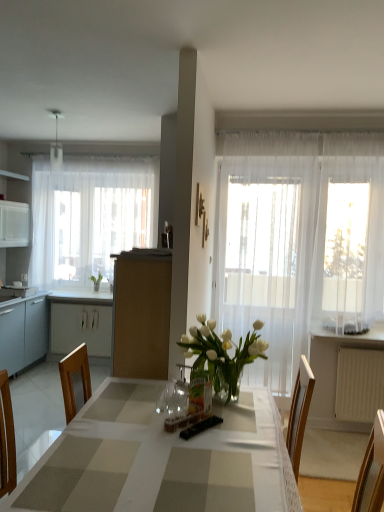
Describe the element at coordinates (90, 216) in the screenshot. Image resolution: width=384 pixels, height=512 pixels. I see `white sheer curtain at left, the 2th curtain in the right-to-left sequence` at that location.

This screenshot has height=512, width=384. What are the coordinates of `transparent fabric window at right` in the screenshot? It's located at (349, 244).

Locate an element on the screen. The height and width of the screenshot is (512, 384). white glossy counter top at lower left is located at coordinates (81, 297).

What is the approximate height of green leafy plant at left?

green leafy plant at left is 10.05 inches tall.

Where is `checkered fabric table at center`? checkered fabric table at center is located at coordinates (162, 459).

Locate an element on the screen. The width and height of the screenshot is (384, 512). white sheer curtain at left, the first curtain from the left is located at coordinates (90, 216).

Which is behind, green leafy plant at left or white glossy counter top at lower left?

green leafy plant at left is more distant.

Which object is thinner, green leafy plant at left or white glossy counter top at lower left?

green leafy plant at left.

Considering the sizes of green leafy plant at left and white glossy counter top at lower left in the image, is green leafy plant at left taller or shorter than white glossy counter top at lower left?

Clearly, green leafy plant at left is taller compared to white glossy counter top at lower left.

Would you say white matte cabinet at left, acting as the first cabinetry starting from the back, is to the left or to the right of checkered fabric table at center in the picture?

Clearly, white matte cabinet at left, acting as the first cabinetry starting from the back, is on the left of checkered fabric table at center in the image.

You are a GUI agent. You are given a task and a screenshot of the screen. Output one action in this format:
    pyautogui.click(x=<x>, y=<y>)
    Task: Click on the cabinetry that is the 2nd one when counting backward from the checkered fabric table at center
    
    Given the screenshot: What is the action you would take?
    pyautogui.click(x=80, y=322)

Could you tell me if white matte cabinet at left, which is counted as the 1th cabinetry, starting from the right, is facing checkered fabric table at center?

Yes, white matte cabinet at left, which is counted as the 1th cabinetry, starting from the right, is oriented towards checkered fabric table at center.

From a real-world perspective, is white matte cabinet at left, the second cabinetry positioned from the front, above or below checkered fabric table at center?

In terms of real-world spatial position, white matte cabinet at left, the second cabinetry positioned from the front, is below checkered fabric table at center.

Is white sheer curtain at left, the 2th curtain in the right-to-left sequence, not within translucent glass vase at center?

white sheer curtain at left, the 2th curtain in the right-to-left sequence, lies outside translucent glass vase at center's area.

Who is bigger, white sheer curtain at left, the first curtain from the left, or translucent glass vase at center?

white sheer curtain at left, the first curtain from the left.

From the image's perspective, which is below, white sheer curtain at left, which ranks as the first curtain in back-to-front order, or translucent glass vase at center?

translucent glass vase at center.

The image size is (384, 512). What are the coordinates of `the 2nd curtain directly above the translucent glass vase at center (from a real-world perspective)` in the screenshot? It's located at (90, 216).

Is matte blue cabinet at left, the first cabinetry from the front, not within white sheer curtain at left, the 2th curtain in the right-to-left sequence?

Indeed, matte blue cabinet at left, the first cabinetry from the front, is completely outside white sheer curtain at left, the 2th curtain in the right-to-left sequence.

Which object is more forward, matte blue cabinet at left, which is the 2th cabinetry from right to left, or white sheer curtain at left, which ranks as the first curtain in back-to-front order?

matte blue cabinet at left, which is the 2th cabinetry from right to left, is closer to the camera.

Between matte blue cabinet at left, which is the 2th cabinetry from right to left, and white sheer curtain at left, the first curtain from the left, which one has larger size?

With larger size is matte blue cabinet at left, which is the 2th cabinetry from right to left.

From a real-world perspective, is matte blue cabinet at left, which is the 2th cabinetry from right to left, physically above white sheer curtain at left, which ranks as the first curtain in back-to-front order?

Actually, matte blue cabinet at left, which is the 2th cabinetry from right to left, is physically below white sheer curtain at left, which ranks as the first curtain in back-to-front order, in the real world.

Is checkered fabric table at center oriented towards matte blue cabinet at left, which is the 2th cabinetry from right to left?

No, checkered fabric table at center is not facing towards matte blue cabinet at left, which is the 2th cabinetry from right to left.

Considering their positions, is checkered fabric table at center located in front of or behind matte blue cabinet at left, which ranks as the 2th cabinetry in back-to-front order?

Clearly, checkered fabric table at center is in front of matte blue cabinet at left, which ranks as the 2th cabinetry in back-to-front order.

In terms of height, does checkered fabric table at center look taller or shorter compared to matte blue cabinet at left, which is the 2th cabinetry from right to left?

Clearly, checkered fabric table at center is shorter compared to matte blue cabinet at left, which is the 2th cabinetry from right to left.

From the image's perspective, starting from the checkered fabric table at center, which cabinetry is the 2nd one above? Please provide its 2D coordinates.

[(23, 331)]

Measure the distance between white matte cabinet at left, the second cabinetry positioned from the front, and matte blue cabinet at left, which is the 2th cabinetry from right to left.

white matte cabinet at left, the second cabinetry positioned from the front, is 17.29 inches from matte blue cabinet at left, which is the 2th cabinetry from right to left.

From the image's perspective, is white matte cabinet at left, which is counted as the 1th cabinetry, starting from the right, under matte blue cabinet at left, which ranks as the 1th cabinetry in left-to-right order?

Yes.

Does point (106, 322) come in front of point (22, 335)?

No.

Can you confirm if white matte cabinet at left, the second cabinetry positioned from the front, is positioned to the right of matte blue cabinet at left, the first cabinetry from the front?

Yes.

How many degrees apart are the facing directions of white plastic radiator at lower right and white matte cabinet at left, which is the second cabinetry from left to right?

2.62 degrees separate the facing orientations of white plastic radiator at lower right and white matte cabinet at left, which is the second cabinetry from left to right.

Does white plastic radiator at lower right have a larger size compared to white matte cabinet at left, which is counted as the 1th cabinetry, starting from the right?

Actually, white plastic radiator at lower right might be smaller than white matte cabinet at left, which is counted as the 1th cabinetry, starting from the right.

From the image's perspective, is white plastic radiator at lower right below white matte cabinet at left, the second cabinetry positioned from the front?

Yes, from the image's perspective, white plastic radiator at lower right is below white matte cabinet at left, the second cabinetry positioned from the front.

The height and width of the screenshot is (512, 384). Identify the location of houseplant above the white glossy counter top at lower left (from the image's perspective). (96, 281).

Image resolution: width=384 pixels, height=512 pixels. Identify the location of the 1st cabinetry counting from the left side of the checkered fabric table at center. (80, 322).

In the scene shown: Based on their spatial positions, is transparent fabric window at right or green leafy plant at left closer to checkered fabric table at center?

Based on the image, transparent fabric window at right appears to be nearer to checkered fabric table at center.

Considering their positions, is white sheer curtain at left, which ranks as the first curtain in back-to-front order, positioned further to white sheer curtain at center, which is the 2th curtain in back-to-front order, than checkered fabric table at center?

white sheer curtain at left, which ranks as the first curtain in back-to-front order, is further to white sheer curtain at center, which is the 2th curtain in back-to-front order.

Which object lies nearer to the anchor point white glossy counter top at lower left, white matte cabinet at left, acting as the first cabinetry starting from the back, or matte blue cabinet at left, which is the 2th cabinetry from right to left?

Based on the image, white matte cabinet at left, acting as the first cabinetry starting from the back, appears to be nearer to white glossy counter top at lower left.

Looking at this image, estimate the real-world distances between objects in this image. Which object is closer to white matte cabinet at left, which is the second cabinetry from left to right, matte blue cabinet at left, which is the 2th cabinetry from right to left, or white sheer curtain at center, placed as the first curtain when sorted from front to back?

matte blue cabinet at left, which is the 2th cabinetry from right to left, is positioned closer to the anchor white matte cabinet at left, which is the second cabinetry from left to right.

When comparing their distances from green leafy plant at left, does white sheer curtain at left, the first curtain from the left, or white sheer curtain at center, placed as the first curtain when sorted from front to back, seem further?

Based on the image, white sheer curtain at center, placed as the first curtain when sorted from front to back, appears to be further to green leafy plant at left.

When comparing their distances from white glossy counter top at lower left, does white sheer curtain at center, placed as the first curtain when sorted from front to back, or white sheer curtain at left, which ranks as the first curtain in back-to-front order, seem further?

white sheer curtain at center, placed as the first curtain when sorted from front to back.

Estimate the real-world distances between objects in this image. Which object is further from white glossy counter top at lower left, checkered fabric table at center or green leafy plant at left?

checkered fabric table at center is further to white glossy counter top at lower left.

From the image, which object appears to be farther from translucent glass vase at center, white matte cabinet at left, acting as the first cabinetry starting from the back, or matte blue cabinet at left, which ranks as the 1th cabinetry in left-to-right order?

white matte cabinet at left, acting as the first cabinetry starting from the back.

At what (x,y) coordinates should I click in order to perform the action: click on houseplant that lies between white sheer curtain at left, positioned as the second curtain in front-to-back order, and matte blue cabinet at left, which ranks as the 2th cabinetry in back-to-front order, from top to bottom. Please return your answer as a coordinate pair (x, y). The height and width of the screenshot is (512, 384). Looking at the image, I should click on click(x=96, y=281).

The width and height of the screenshot is (384, 512). I want to click on houseplant between white glossy counter top at lower left and white plastic radiator at lower right, so click(96, 281).

You are a GUI agent. You are given a task and a screenshot of the screen. Output one action in this format:
    pyautogui.click(x=<x>, y=<y>)
    Task: Click on the radiator between checkered fabric table at center and white glossy counter top at lower left along the z-axis
    Image resolution: width=384 pixels, height=512 pixels.
    Given the screenshot: What is the action you would take?
    pyautogui.click(x=359, y=384)

This screenshot has width=384, height=512. Identify the location of window between translucent glass vase at center and white sheer curtain at left, the 2th curtain in the right-to-left sequence, along the z-axis. (349, 244).